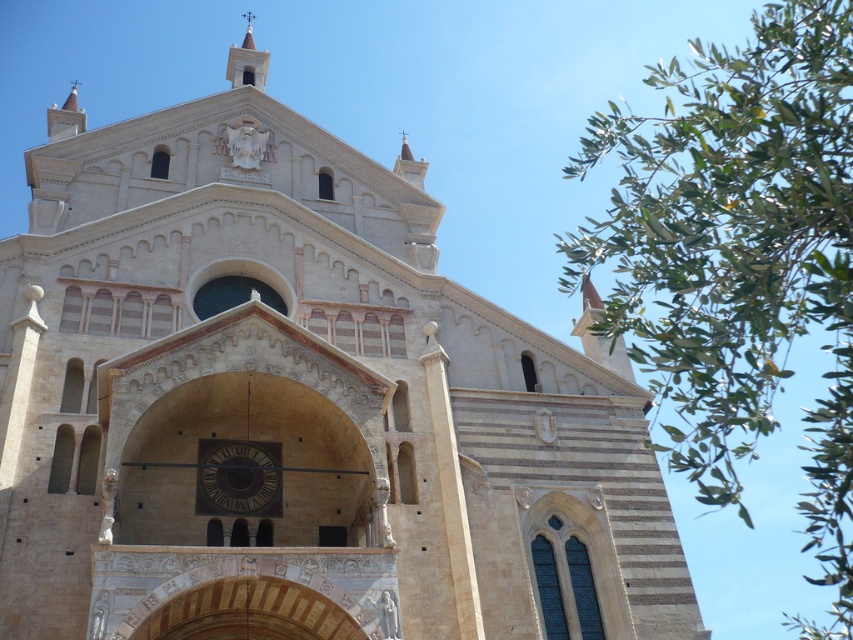
In the scene shown: You are standing in front of the historic building and want to take a photo that includes both the green leafy tree at upper right and the dark brown wooden clock at center. Which object should you position higher in your camera frame?

The green leafy tree at upper right should be positioned higher in your camera frame because it is located above the dark brown wooden clock at center.

You are standing in front of the historic building and want to take a photo that includes both the green leafy tree at upper right and the dark brown wooden clock at center. Which object should you position to the right side in your camera frame?

The green leafy tree at upper right is positioned on the right side of dark brown wooden clock at center, so you should position the green leafy tree at upper right to the right side in your camera frame.

You are standing 10 meters away from the cathedral facade. You want to take a photo that includes both the cathedral and the green leafy tree at upper right. Is the tree close enough to be in the same frame as the cathedral?

The green leafy tree at upper right is 29.18 meters away from the camera. Since you are only 10 meters away from the cathedral facade, the tree is further away than the cathedral, so it may not be in the same frame unless you use a wide angle lens or move closer.